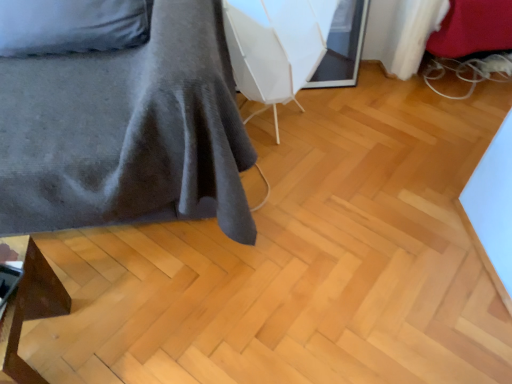
You are a GUI agent. You are given a task and a screenshot of the screen. Output one action in this format:
    pyautogui.click(x=<x>, y=<y>)
    Task: Click on the vacant area situated below white plastic swivel chair at center (from a real-world perspective)
    This screenshot has width=512, height=384.
    Given the screenshot: What is the action you would take?
    pyautogui.click(x=279, y=127)